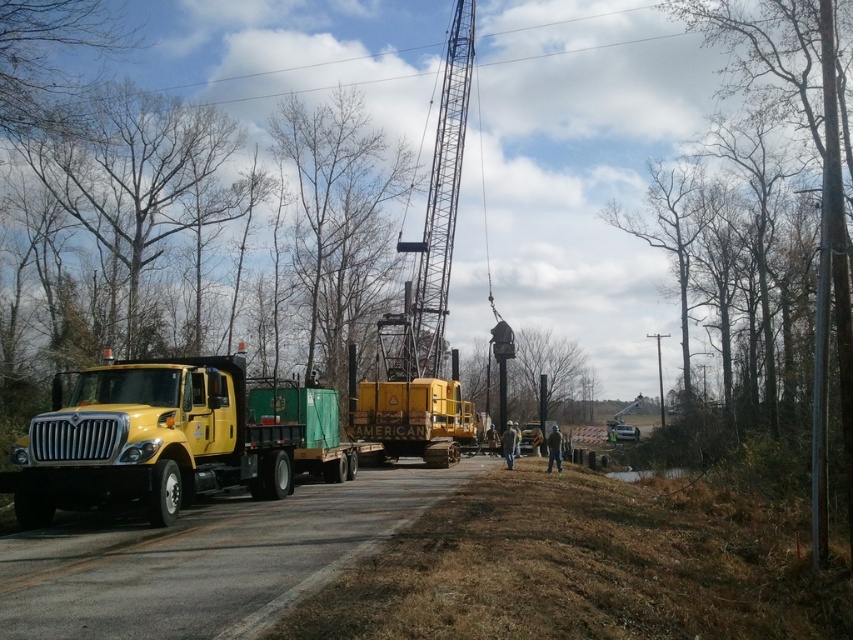
Question: Is yellow matte truck at left positioned before metallic gray crane at upper center?

Choices:
 (A) no
 (B) yes

Answer: (B)

Question: Where is yellow matte truck at left located in relation to metallic gray crane at upper center in the image?

Choices:
 (A) below
 (B) above

Answer: (A)

Question: Is yellow matte truck at left to the right of metallic gray crane at upper center from the viewer's perspective?

Choices:
 (A) no
 (B) yes

Answer: (A)

Question: Which point is farther from the camera taking this photo?

Choices:
 (A) (248, 396)
 (B) (431, 204)

Answer: (B)

Question: Which object appears farthest from the camera in this image?

Choices:
 (A) metallic gray crane at upper center
 (B) yellow matte truck at left

Answer: (A)